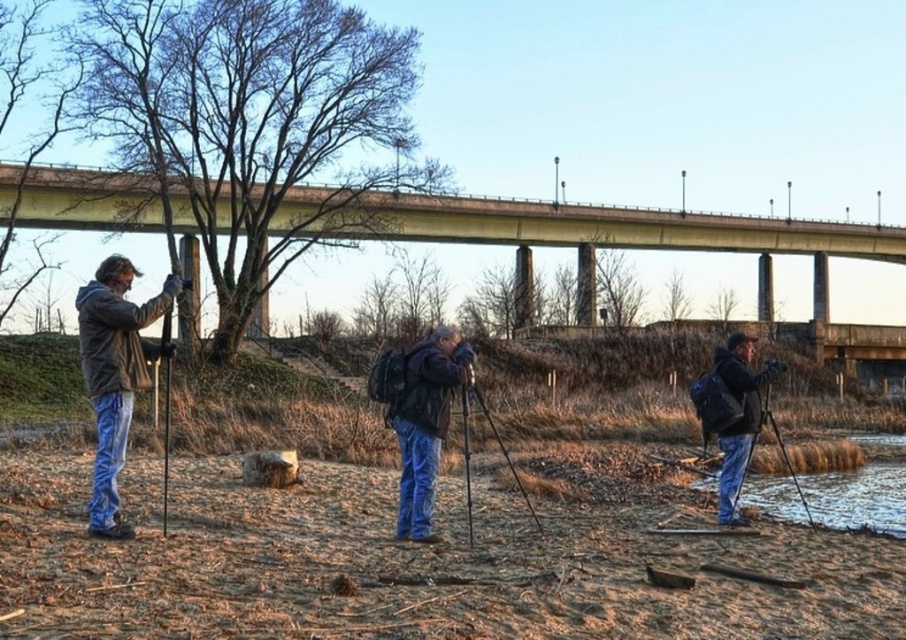
Is point (368, 205) positioned in front of point (415, 426)?

No, (368, 205) is further to viewer.

Is point (290, 200) behind point (449, 336)?

Yes, it is behind point (449, 336).

Find the location of `concrete bridge at upper center`. concrete bridge at upper center is located at coordinates (596, 234).

Is brown muddy water at lower right closer to camera compared to dark blue jacket at right?

No, brown muddy water at lower right is further to the viewer.

Does brown muddy water at lower right have a greater width compared to dark blue jacket at right?

Yes.

Does point (776, 484) come farther from viewer compared to point (779, 365)?

That is True.

The width and height of the screenshot is (906, 640). I want to click on brown muddy water at lower right, so click(x=840, y=488).

Who is lower down, matte black jacket at left or black matte tripod at center?

black matte tripod at center is lower down.

Locate an element on the screen. Image resolution: width=906 pixels, height=640 pixels. matte black jacket at left is located at coordinates (114, 374).